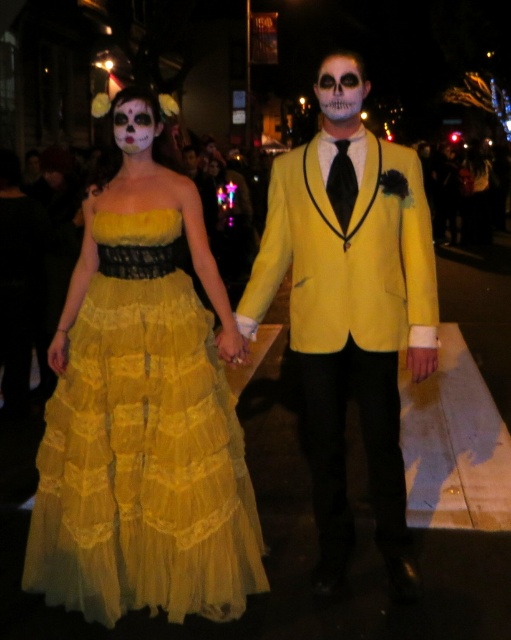
Where is the yellow tulle dress at center located in the image?

The yellow tulle dress at center is located at point (x=143, y=448).

You are a photographer trying to capture the two people in the yellow tulle dress at center and the other person. Since they are 2.66 meters apart, what is the minimum distance your camera lens should have to ensure both are in focus?

The minimum distance your camera lens should have to ensure both the yellow tulle dress at center and the other person are in focus is 2.66 meters.

You are a photographer at the event and want to capture a photo of both the yellow tulle dress at center and the white painted skull at center in the same frame. Your camera has a maximum focus range of 5 feet. Can you take a photo that includes both subjects without moving your position?

The distance between the yellow tulle dress at center and the white painted skull at center is 6.18 feet, which exceeds the camera maximum focus range of 5 feet. Therefore, you cannot take a photo that includes both subjects without moving your position.